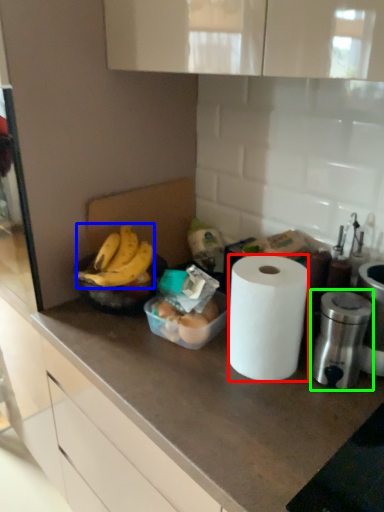
Question: Which object is positioned closest to paper towel (highlighted by a red box)? Select from banana (highlighted by a blue box) and appliance (highlighted by a green box).

Choices:
 (A) banana
 (B) appliance

Answer: (B)